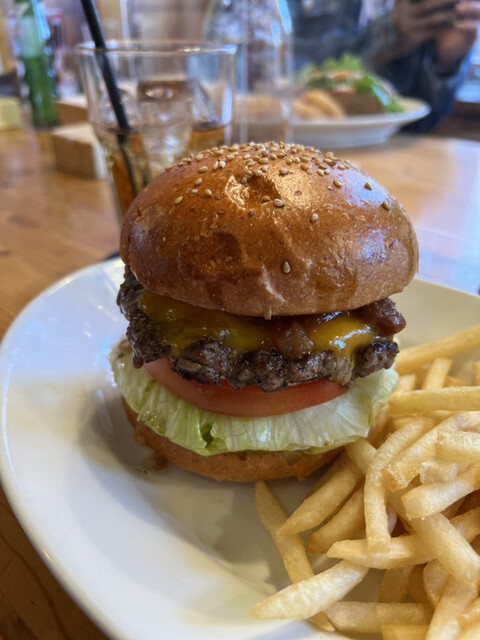
Locate an element on the screen. table is located at coordinates [x=409, y=170].